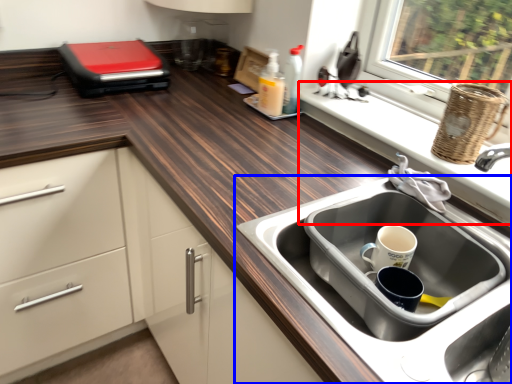
Question: Which object appears farthest to the camera in this image, window sill (highlighted by a red box) or sink (highlighted by a blue box)?

Choices:
 (A) window sill
 (B) sink

Answer: (A)